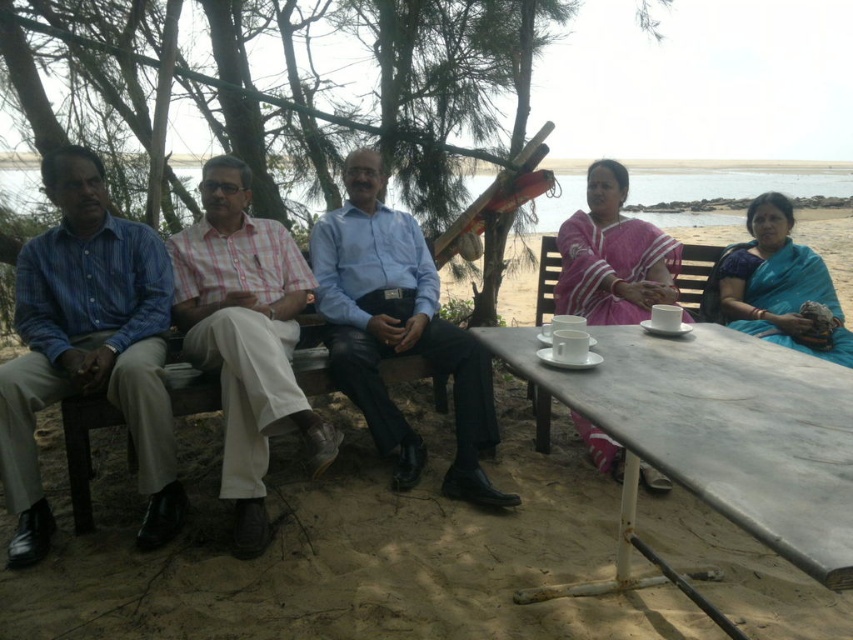
Is blue cotton shirt at left smaller than pink silk saree at center?

Incorrect, blue cotton shirt at left is not smaller in size than pink silk saree at center.

Is point (830, 410) more distant than point (608, 314)?

No, it is in front of (608, 314).

Find the location of a particular element. Image resolution: width=853 pixels, height=640 pixels. blue cotton shirt at left is located at coordinates (752, 476).

Who is positioned more to the right, blue smooth shirt at center or blue cotton shirt at left?

From the viewer's perspective, blue cotton shirt at left appears more on the right side.

Who is taller, blue smooth shirt at center or blue cotton shirt at left?

With more height is blue smooth shirt at center.

Does point (369, 396) come behind point (770, 404)?

Yes.

Locate an element on the screen. blue smooth shirt at center is located at coordinates (397, 330).

Is point (86, 152) closer to camera compared to point (195, 330)?

That is False.

Does point (50, 355) lie behind point (238, 340)?

Yes, it is.

Does point (4, 460) come closer to viewer compared to point (222, 276)?

That is True.

Find the location of a particular element. blue striped shirt at left is located at coordinates (88, 348).